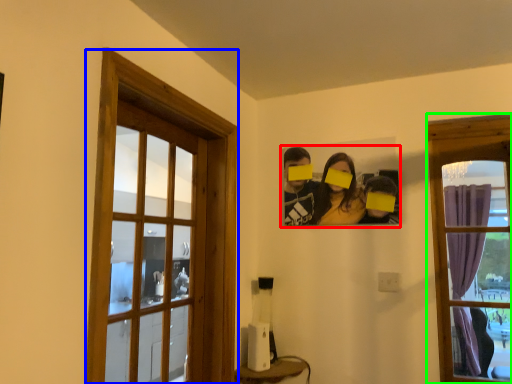
Question: Estimate the real-world distances between objects in this image. Which object is closer to couple (highlighted by a red box), window (highlighted by a blue box) or window (highlighted by a green box)?

Choices:
 (A) window
 (B) window

Answer: (B)